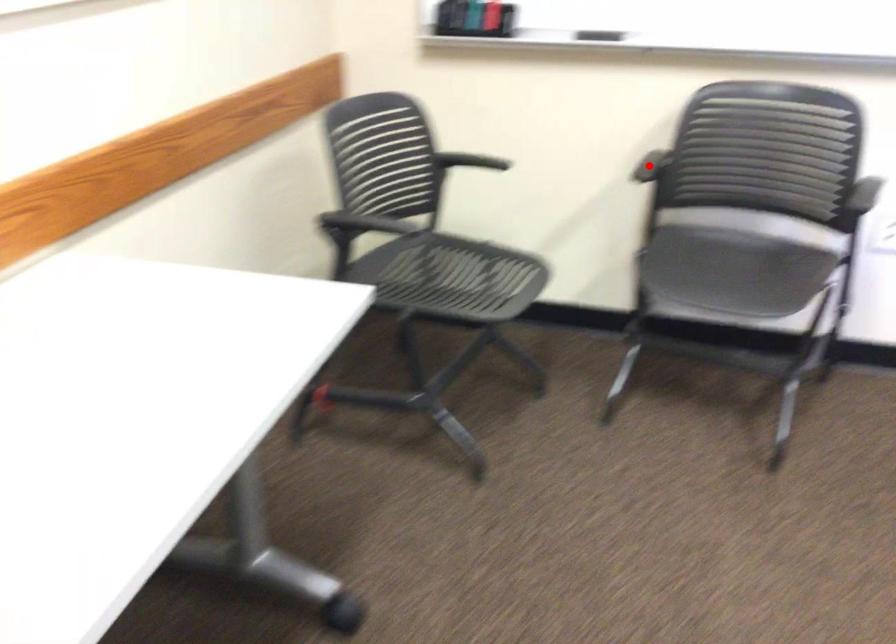
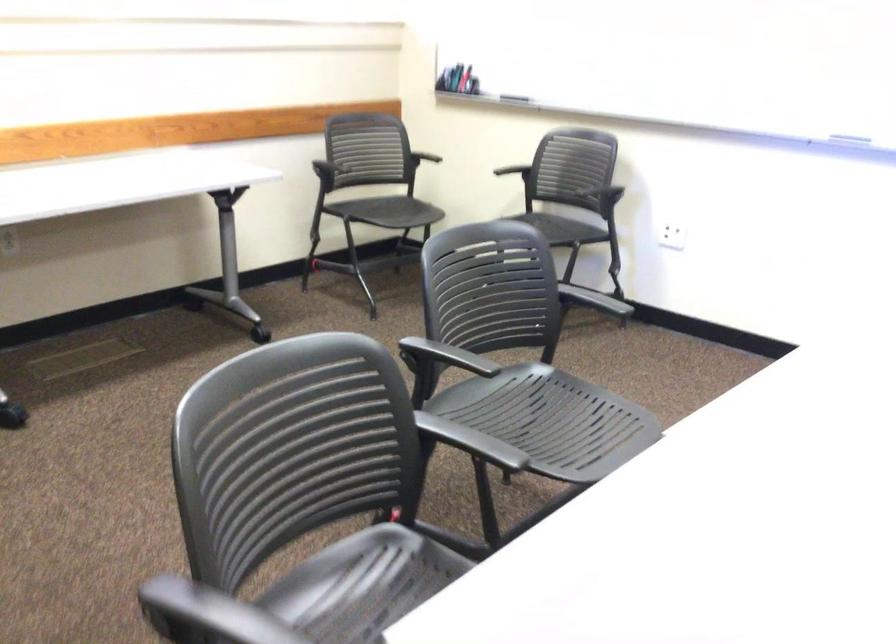
Question: I am providing you with two images of the same scene from different viewpoints. A red point is shown in image1. For the corresponding object point in image2, is it positioned nearer or farther from the camera?

Choices:
 (A) Nearer
 (B) Farther

Answer: (B)